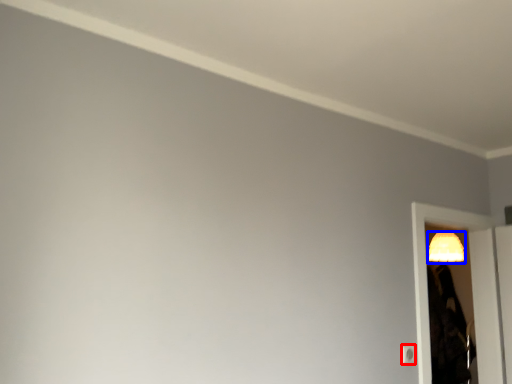
Question: Among these objects, which one is farthest to the camera, light switch (highlighted by a red box) or lamp (highlighted by a blue box)?

Choices:
 (A) light switch
 (B) lamp

Answer: (B)